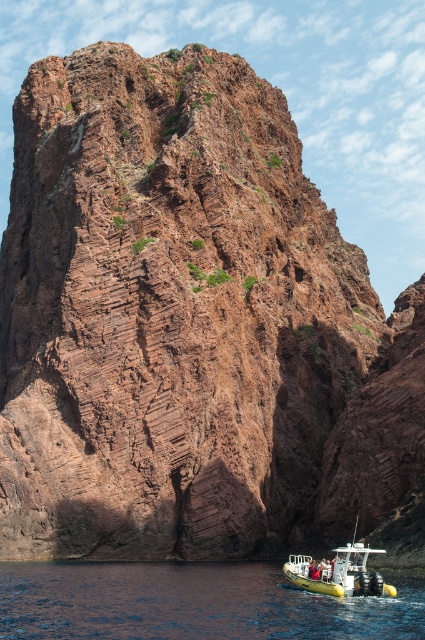
Question: Can you confirm if blue rubber boat at lower right is positioned above yellow rubber boat at lower center?

Choices:
 (A) yes
 (B) no

Answer: (B)

Question: Which object is farther from the camera taking this photo?

Choices:
 (A) yellow rubber boat at lower center
 (B) blue rubber boat at lower right

Answer: (A)

Question: Among these points, which one is nearest to the camera?

Choices:
 (A) (359, 550)
 (B) (309, 596)

Answer: (A)

Question: Observing the image, what is the correct spatial positioning of blue rubber boat at lower right in reference to yellow rubber boat at lower center?

Choices:
 (A) left
 (B) right

Answer: (A)

Question: Can you confirm if blue rubber boat at lower right is wider than yellow rubber boat at lower center?

Choices:
 (A) yes
 (B) no

Answer: (A)